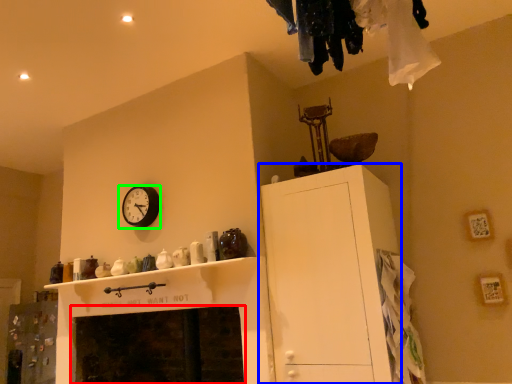
Question: Considering the real-world distances, which object is farthest from fireplace (highlighted by a red box)? cabinetry (highlighted by a blue box) or wall clock (highlighted by a green box)?

Choices:
 (A) cabinetry
 (B) wall clock

Answer: (A)